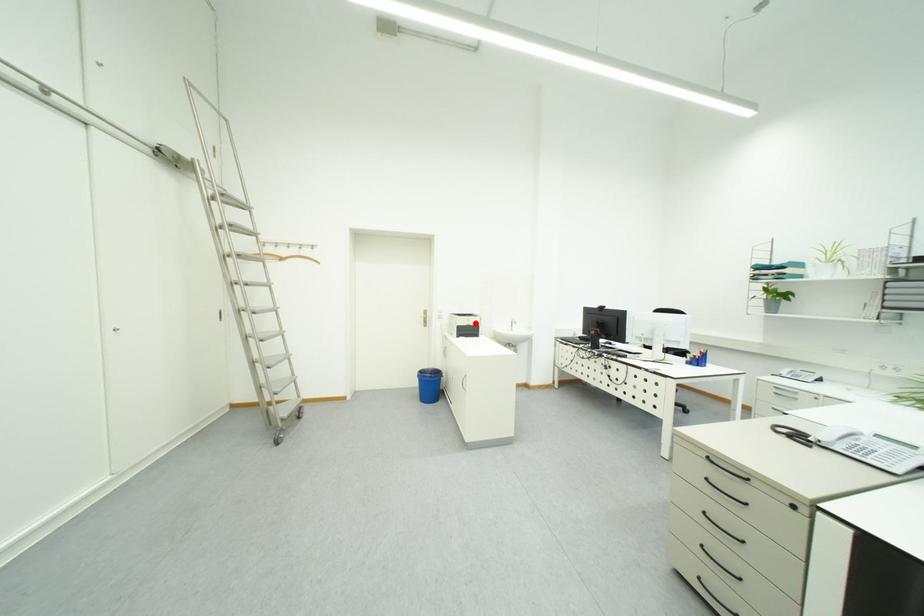
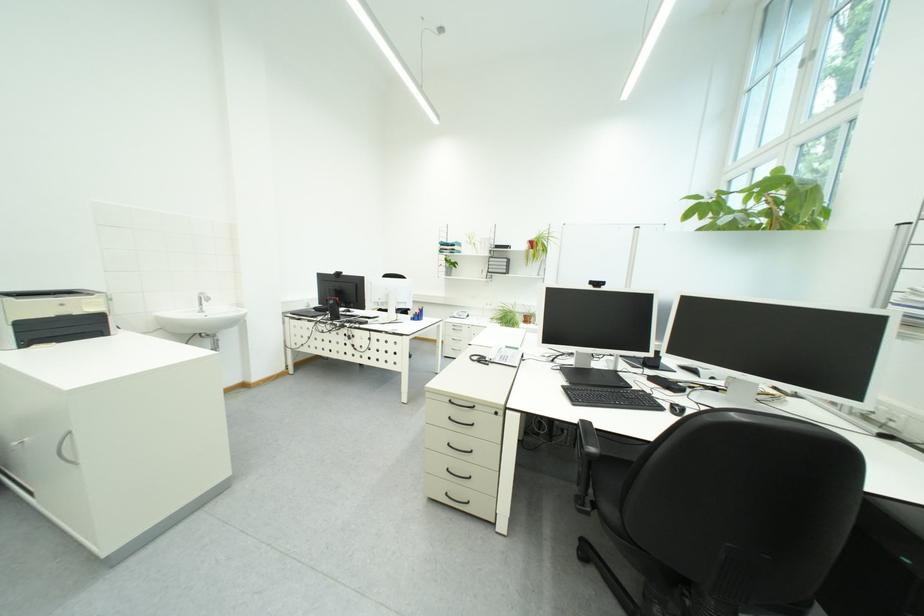
In the second image, find the point that corresponds to the highlighted location in the first image.

(55, 310)